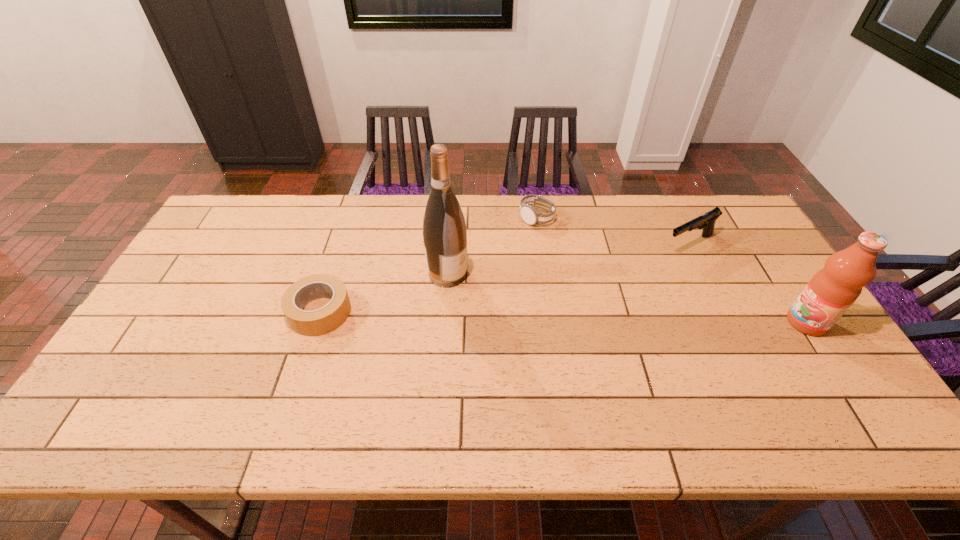
Locate an element on the screen. free spot located on the face of the fourth tallest object is located at coordinates (548, 247).

Where is `free region located 0.310m on the face of the fourth tallest object`? The image size is (960, 540). free region located 0.310m on the face of the fourth tallest object is located at coordinates (568, 298).

Image resolution: width=960 pixels, height=540 pixels. Identify the location of vacant space situated 0.370m at the aiming end of the gun. (577, 298).

Where is `free space located at the aiming end of the gun`? free space located at the aiming end of the gun is located at coordinates (644, 263).

You are a GUI agent. You are given a task and a screenshot of the screen. Output one action in this format:
    pyautogui.click(x=<x>, y=<y>)
    Task: Click on the blank space located at the aiming end of the gun
    The height and width of the screenshot is (540, 960).
    Given the screenshot: What is the action you would take?
    pyautogui.click(x=600, y=285)

Where is `watch at the far edge`? watch at the far edge is located at coordinates (530, 215).

Image resolution: width=960 pixels, height=540 pixels. I want to click on gun present at the far edge, so click(x=707, y=221).

At what (x,y) coordinates should I click in order to perform the action: click on fruit juice located at the right edge. Please return your answer as a coordinate pair (x, y). The image size is (960, 540). Looking at the image, I should click on (832, 290).

I want to click on gun located in the right edge section of the desktop, so point(707,221).

Identify the location of object at the far right corner. This screenshot has height=540, width=960. (707, 221).